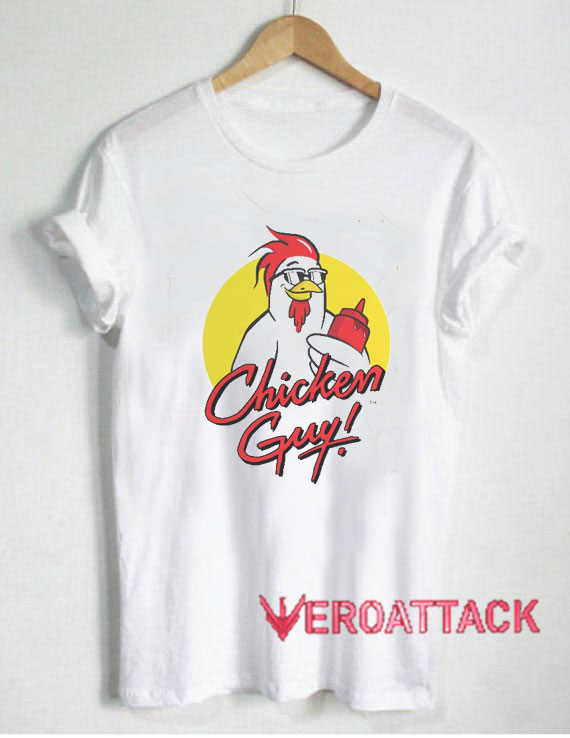
At what (x,y) coordinates should I click in order to perform the action: click on empty wall space. Please return your answer as a coordinate pair (x, y). This screenshot has width=570, height=738. Looking at the image, I should click on (540, 435), (57, 454).